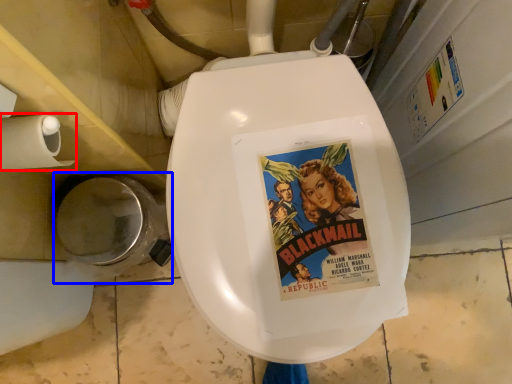
Question: Which object appears farthest to the camera in this image, toilet paper (highlighted by a red box) or toilet bowl (highlighted by a blue box)?

Choices:
 (A) toilet paper
 (B) toilet bowl

Answer: (B)